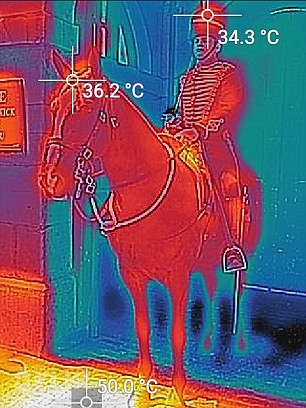
At what (x,y) coordinates should I click in order to perform the action: click on brick wall. Please return your answer as a coordinate pair (x, y). This screenshot has width=306, height=408. Looking at the image, I should click on (22, 261).